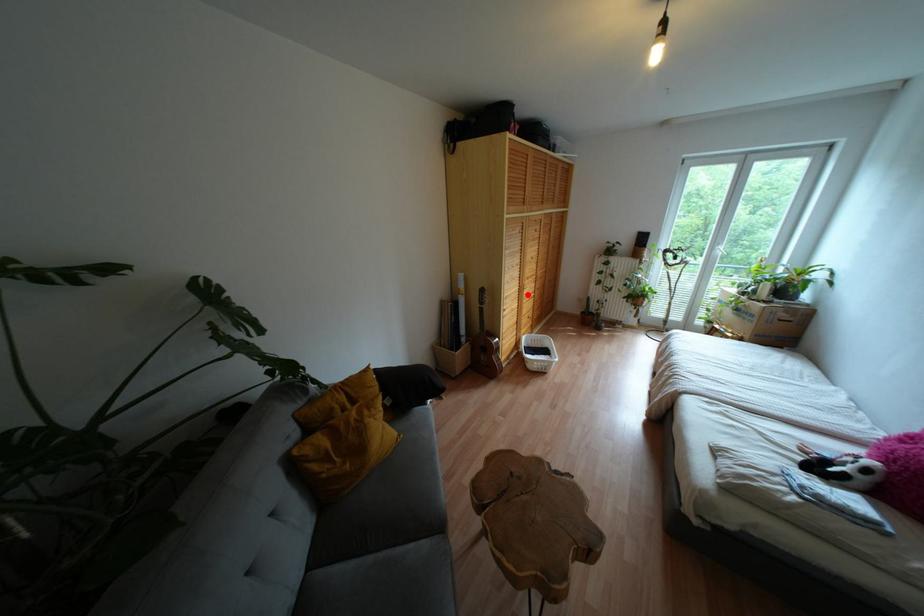
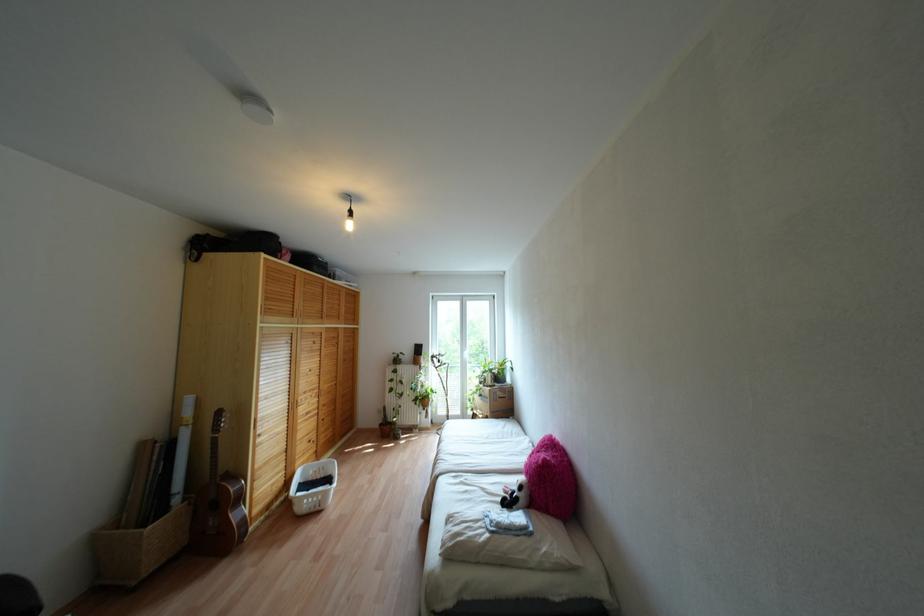
Question: I am providing you with two images of the same scene from different viewpoints. Image1 has a red point marked. In image2, the corresponding 3D location appears at what relative position? Reply with the corresponding letter.

Choices:
 (A) Closer
 (B) Farther

Answer: (A)